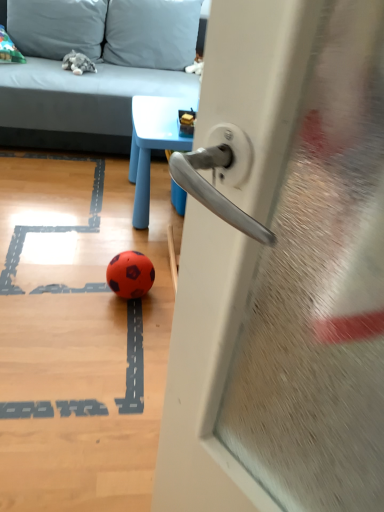
Question: Does soft gray pillow at upper center, which is the second pillow from left to right, lie in front of metallic silver handle at center?

Choices:
 (A) no
 (B) yes

Answer: (A)

Question: Is there a large distance between soft gray pillow at upper center, which is the second pillow from left to right, and metallic silver handle at center?

Choices:
 (A) yes
 (B) no

Answer: (A)

Question: Is metallic silver handle at center at the back of soft gray pillow at upper center, placed as the first pillow when sorted from right to left?

Choices:
 (A) no
 (B) yes

Answer: (A)

Question: Does soft gray pillow at upper center, which is the second pillow from left to right, have a greater height compared to metallic silver handle at center?

Choices:
 (A) no
 (B) yes

Answer: (A)

Question: Can you confirm if soft gray pillow at upper center, which is the second pillow from left to right, is bigger than metallic silver handle at center?

Choices:
 (A) no
 (B) yes

Answer: (B)

Question: From the image's perspective, would you say soft gray pillow at upper center, placed as the first pillow when sorted from right to left, is shown under metallic silver handle at center?

Choices:
 (A) yes
 (B) no

Answer: (B)

Question: From the image's perspective, is metallic silver handle at center located beneath soft gray pillow at upper left, arranged as the first pillow when viewed from the left?

Choices:
 (A) yes
 (B) no

Answer: (A)

Question: Can you confirm if metallic silver handle at center is smaller than soft gray pillow at upper left, arranged as the first pillow when viewed from the left?

Choices:
 (A) no
 (B) yes

Answer: (B)

Question: Is metallic silver handle at center not near soft gray pillow at upper left, acting as the second pillow starting from the right?

Choices:
 (A) yes
 (B) no

Answer: (A)

Question: Is the position of metallic silver handle at center less distant than that of soft gray pillow at upper left, acting as the second pillow starting from the right?

Choices:
 (A) yes
 (B) no

Answer: (A)

Question: Is metallic silver handle at center bigger than soft gray pillow at upper left, acting as the second pillow starting from the right?

Choices:
 (A) no
 (B) yes

Answer: (A)

Question: From a real-world perspective, does metallic silver handle at center sit lower than soft gray pillow at upper left, arranged as the first pillow when viewed from the left?

Choices:
 (A) yes
 (B) no

Answer: (B)

Question: Does soft gray pillow at upper left, acting as the second pillow starting from the right, appear on the right side of blue plastic table at upper center?

Choices:
 (A) yes
 (B) no

Answer: (B)